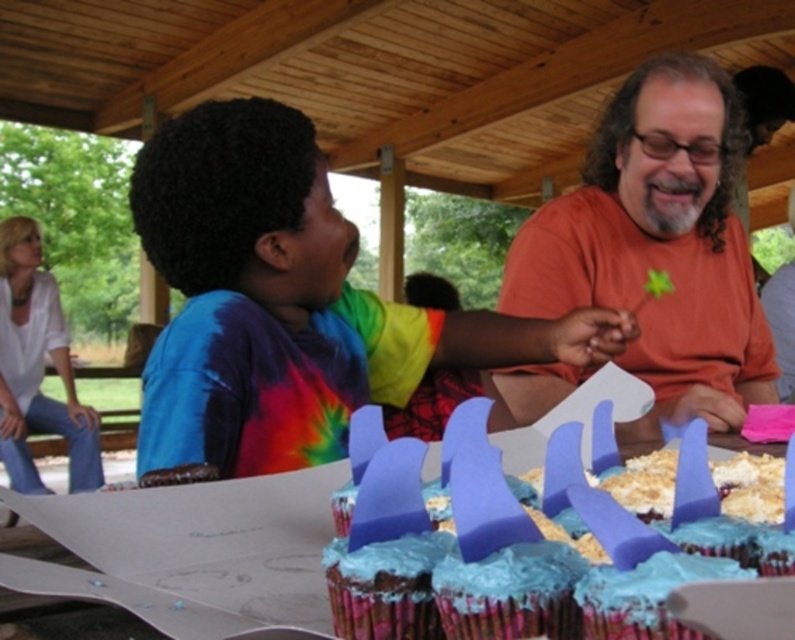
Question: Estimate the real-world distances between objects in this image. Which object is farther from the orange matte shirt at center?

Choices:
 (A) tie-dye shirt at left
 (B) blue foam shark fin at center

Answer: (B)

Question: Estimate the real-world distances between objects in this image. Which object is closer to the blue foam shark fin at center?

Choices:
 (A) tie-dye shirt at left
 (B) orange matte shirt at center

Answer: (A)

Question: Which of the following is the closest to the observer?

Choices:
 (A) blue foam shark fin at center
 (B) tie-dye shirt at left

Answer: (A)

Question: Is tie-dye shirt at left smaller than orange matte shirt at center?

Choices:
 (A) yes
 (B) no

Answer: (B)

Question: Is orange matte shirt at center further to the viewer compared to blue foam shark fin at center?

Choices:
 (A) yes
 (B) no

Answer: (A)

Question: Is orange matte shirt at center to the left of blue foam shark fin at center from the viewer's perspective?

Choices:
 (A) no
 (B) yes

Answer: (A)